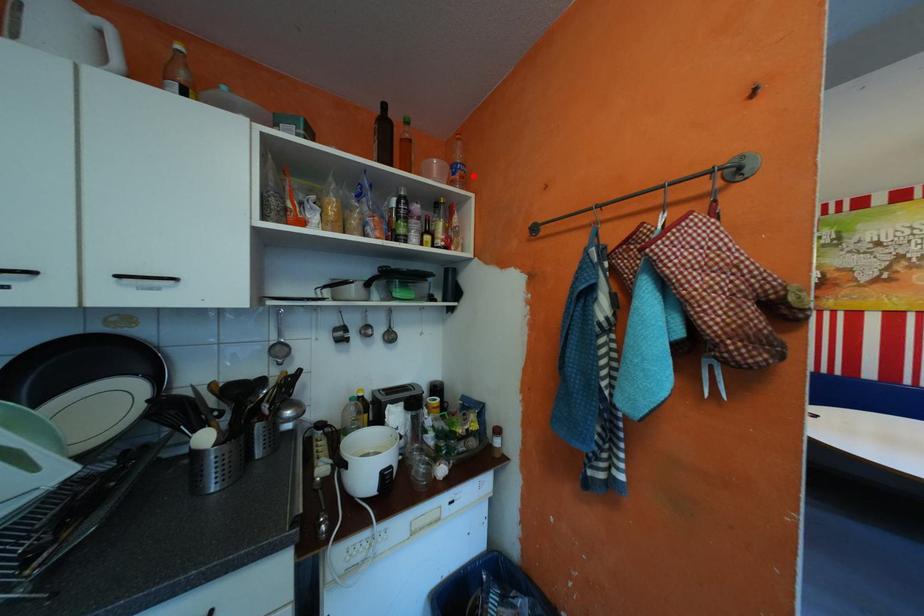
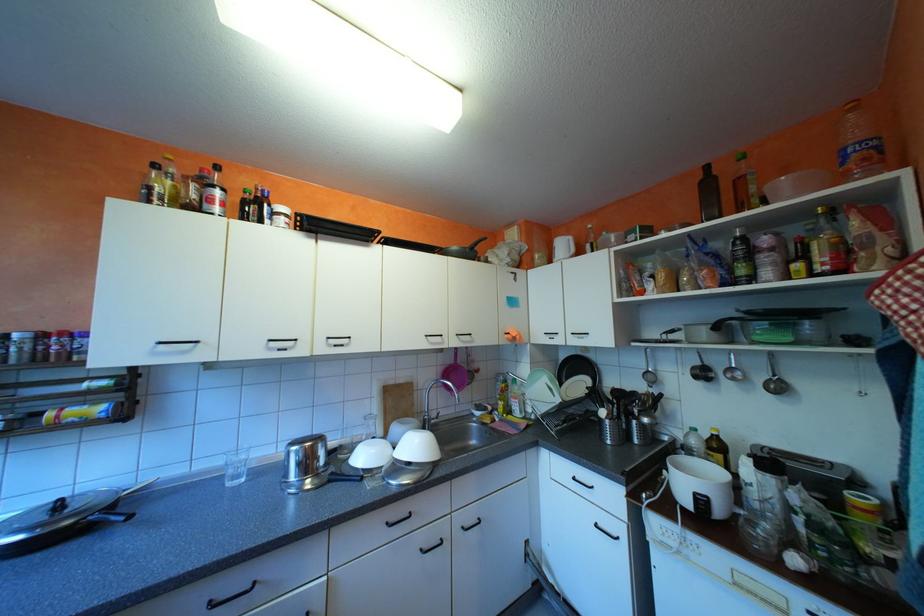
Question: I am providing you with two images of the same scene from different viewpoints. A red point is shown in image1. For the corresponding object point in image2, is it positioned nearer or farther from the camera?

Choices:
 (A) Nearer
 (B) Farther

Answer: (A)